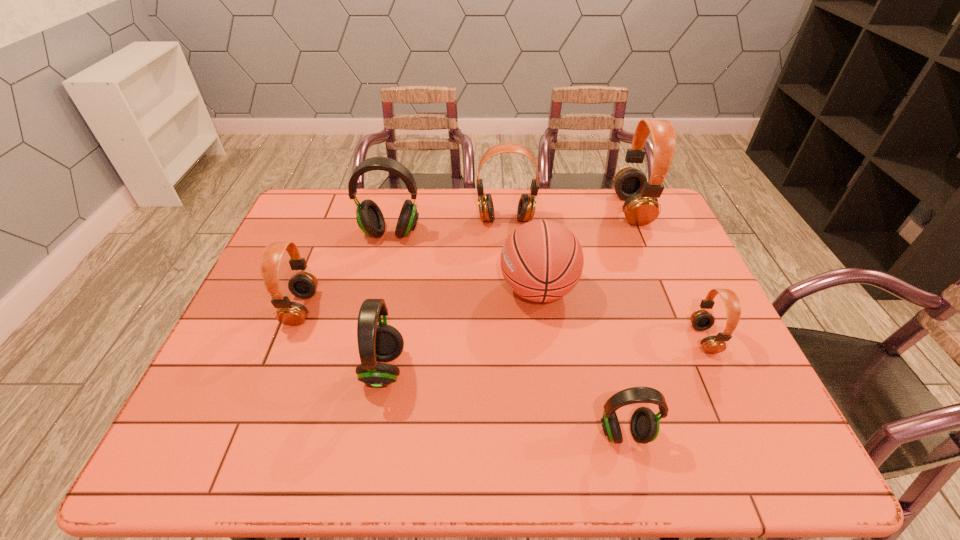
Image resolution: width=960 pixels, height=540 pixels. I want to click on black headset that is the closest to the nearest object, so click(383, 342).

Identify which black headset is the second nearest to the farthest black headset. Please provide its 2D coordinates. Your answer should be formatted as a tuple, i.e. [(x, y)], where the tuple contains the x and y coordinates of a point satisfying the conditions above.

[(644, 425)]

This screenshot has height=540, width=960. I want to click on free space that satisfies the following two spatial constraints: 1. on the ear cups of the biggest brown headset; 2. on the ear cups of the fourth headset from right to left, so click(x=636, y=219).

At what (x,y) coordinates should I click in order to perform the action: click on free point that satisfies the following two spatial constraints: 1. on the ear cups of the tallest headset; 2. on the ear cups of the third smallest brown headset. Please return your answer as a coordinate pair (x, y). Looking at the image, I should click on (636, 219).

Locate an element on the screen. free location that satisfies the following two spatial constraints: 1. on the ear cups of the tallest headset; 2. on the ear cups of the nearest object is located at coordinates (726, 433).